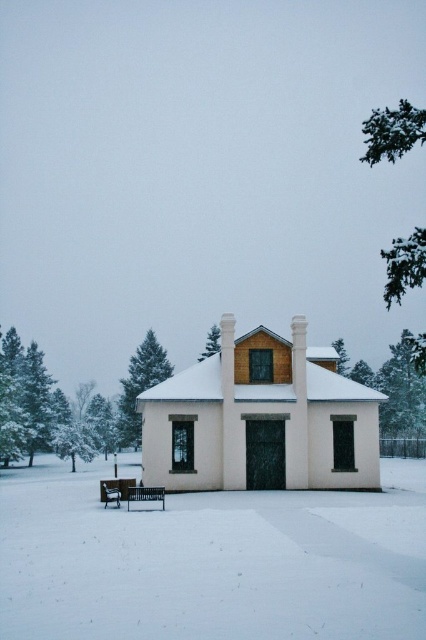
Question: Is white powdery snow at center to the right of green textured pine tree at upper left from the viewer's perspective?

Choices:
 (A) no
 (B) yes

Answer: (B)

Question: Among these points, which one is nearest to the camera?

Choices:
 (A) (255, 584)
 (B) (158, 372)

Answer: (A)

Question: Which of the following is the closest to the observer?

Choices:
 (A) green textured pine tree at upper left
 (B) white powdery snow at center
 (C) metallic black bench at lower center
 (D) green leafy tree at upper right

Answer: (B)

Question: Is green leafy tree at upper right positioned before green textured pine tree at upper left?

Choices:
 (A) yes
 (B) no

Answer: (A)

Question: Does white powdery snow at center appear on the left side of wooden bench at lower left?

Choices:
 (A) yes
 (B) no

Answer: (B)

Question: Estimate the real-world distances between objects in this image. Which object is closer to the white powdery snow at center?

Choices:
 (A) green textured pine tree at upper left
 (B) green textured pine tree at center
 (C) wooden bench at lower left
 (D) green leafy tree at upper right

Answer: (C)